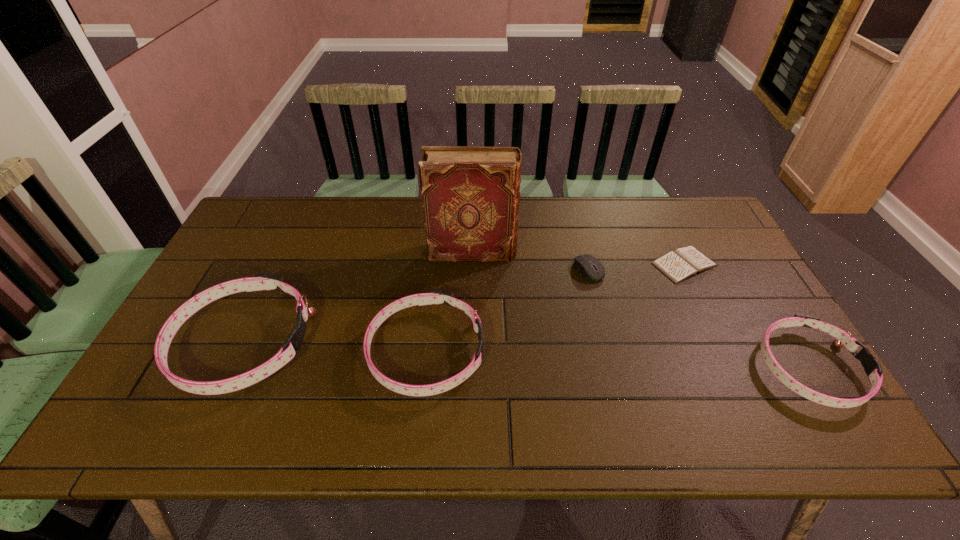
Locate an element on the screen. The width and height of the screenshot is (960, 540). vacant region between the fourth shortest object and the diary is located at coordinates (555, 308).

The height and width of the screenshot is (540, 960). Identify the location of free space between the second shortest object and the leftmost dog collar. (417, 307).

The height and width of the screenshot is (540, 960). What are the coordinates of `vacant area that lies between the third object from right to left and the hardback book` in the screenshot? It's located at (531, 261).

Find the location of `free area in between the shortest dog collar and the fourth shortest object`. free area in between the shortest dog collar and the fourth shortest object is located at coordinates (617, 360).

This screenshot has height=540, width=960. I want to click on object that ranks as the second closest to the shortest dog collar, so click(x=584, y=263).

Identify the location of the second closest object to the tallest object. (435, 296).

Identify which dog collar is the third closest to the hardback book. Please provide its 2D coordinates. Your answer should be formatted as a tuple, i.e. [(x, y)], where the tuple contains the x and y coordinates of a point satisfying the conditions above.

[(872, 367)]

Find the location of `dog collar that can be found as the second closest to the leftmost dog collar`. dog collar that can be found as the second closest to the leftmost dog collar is located at coordinates (872, 367).

Where is `free spot that satisfies the following two spatial constraints: 1. on the spine side of the fourth object from left to right; 2. on the left side of the hardback book`? Image resolution: width=960 pixels, height=540 pixels. free spot that satisfies the following two spatial constraints: 1. on the spine side of the fourth object from left to right; 2. on the left side of the hardback book is located at coordinates (472, 269).

In order to click on vacant space that satisfies the following two spatial constraints: 1. on the spine side of the fifth tallest object; 2. on the right side of the tallest object in this screenshot , I will do `click(472, 269)`.